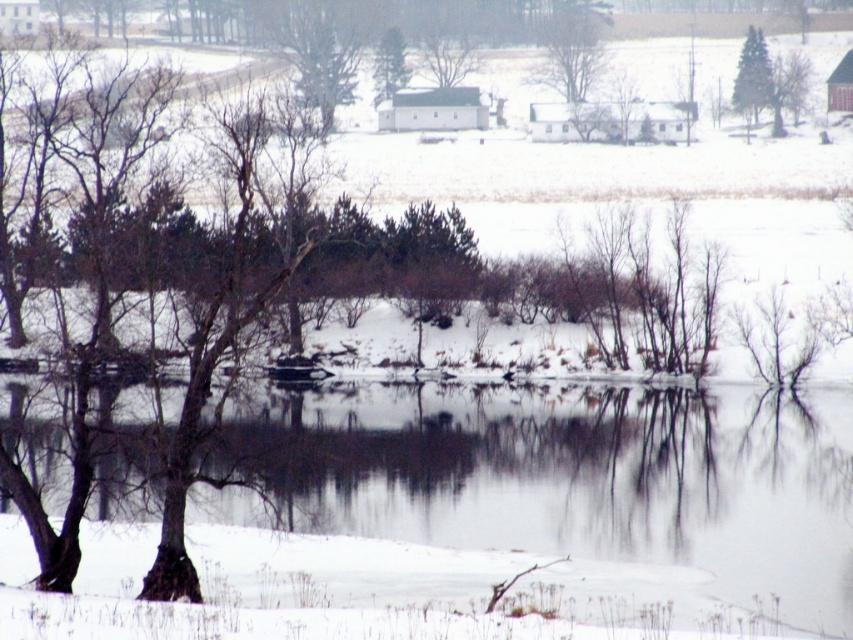
Question: Can you confirm if bare branches at upper center is positioned above smooth bark tree at upper right?

Choices:
 (A) no
 (B) yes

Answer: (B)

Question: Estimate the real-world distances between objects in this image. Which object is closer to the bare branches at upper center?

Choices:
 (A) smooth bark tree at upper right
 (B) green matte tree at upper right
 (C) clear water at lower center
 (D) green matte tree at upper center

Answer: (A)

Question: Can you confirm if clear water at lower center is wider than bare branches at upper center?

Choices:
 (A) yes
 (B) no

Answer: (A)

Question: Estimate the real-world distances between objects in this image. Which object is farther from the green matte tree at upper right?

Choices:
 (A) green matte tree at upper center
 (B) smooth bark tree at upper right
 (C) bare branches at upper center

Answer: (A)

Question: Does bare branches at upper center have a lesser width compared to green matte tree at upper center?

Choices:
 (A) no
 (B) yes

Answer: (A)

Question: Which point is closer to the camera?

Choices:
 (A) (384, 42)
 (B) (587, 42)
 (C) (805, 76)
 (D) (743, 92)

Answer: (D)